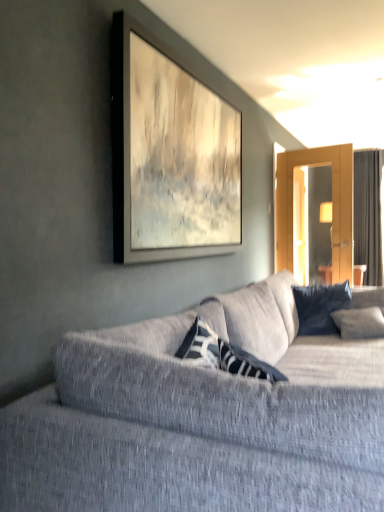
Question: Can you confirm if dark blue textured pillow at center is wider than textured gray couch at center?

Choices:
 (A) yes
 (B) no

Answer: (B)

Question: Does dark blue textured pillow at center have a lesser width compared to textured gray couch at center?

Choices:
 (A) no
 (B) yes

Answer: (B)

Question: Are dark blue textured pillow at center and textured gray couch at center making contact?

Choices:
 (A) yes
 (B) no

Answer: (B)

Question: Is dark blue textured pillow at center to the left of textured gray couch at center from the viewer's perspective?

Choices:
 (A) yes
 (B) no

Answer: (B)

Question: Is dark blue textured pillow at center positioned with its back to textured gray couch at center?

Choices:
 (A) yes
 (B) no

Answer: (A)

Question: Can you confirm if dark blue textured pillow at center is bigger than textured gray couch at center?

Choices:
 (A) yes
 (B) no

Answer: (B)

Question: Can you confirm if dark blue textured pillow at center is thinner than dark gray fabric curtain at right?

Choices:
 (A) yes
 (B) no

Answer: (B)

Question: Does dark blue textured pillow at center come behind dark gray fabric curtain at right?

Choices:
 (A) yes
 (B) no

Answer: (B)

Question: Is dark blue textured pillow at center closer to the viewer compared to dark gray fabric curtain at right?

Choices:
 (A) yes
 (B) no

Answer: (A)

Question: Does dark blue textured pillow at center have a lesser height compared to dark gray fabric curtain at right?

Choices:
 (A) no
 (B) yes

Answer: (B)

Question: Is dark blue textured pillow at center taller than dark gray fabric curtain at right?

Choices:
 (A) yes
 (B) no

Answer: (B)

Question: Is dark blue textured pillow at center looking in the opposite direction of dark gray fabric curtain at right?

Choices:
 (A) yes
 (B) no

Answer: (B)

Question: Is dark gray fabric curtain at right touching textured gray couch at center?

Choices:
 (A) no
 (B) yes

Answer: (A)